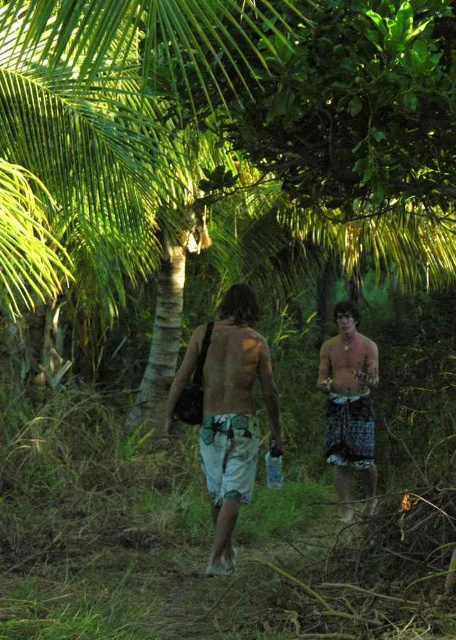
Find the location of a particular element. The height and width of the screenshot is (640, 456). green patterned shorts at center is located at coordinates (233, 412).

The image size is (456, 640). Describe the element at coordinates (233, 412) in the screenshot. I see `green patterned shorts at center` at that location.

The image size is (456, 640). Identify the location of green patterned shorts at center. (233, 412).